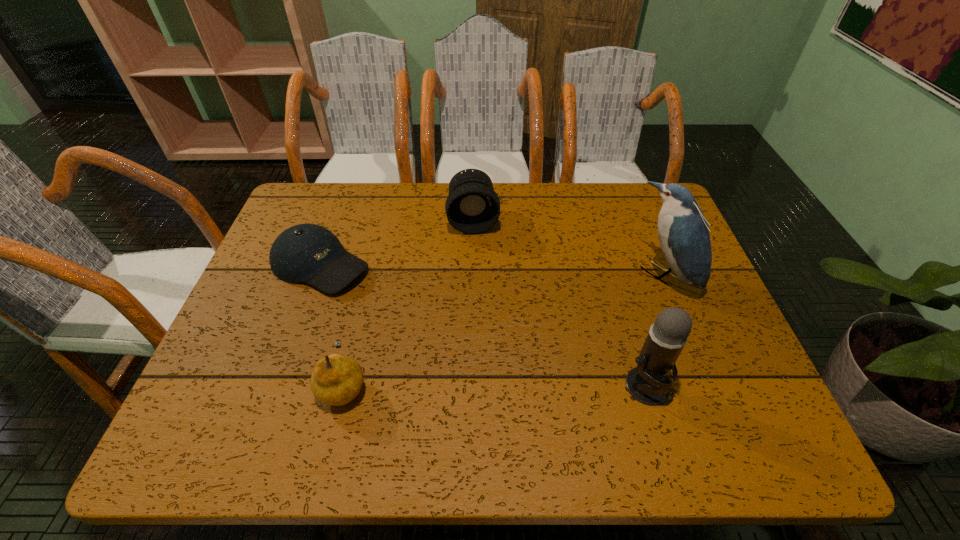
Where is `the second shortest object`? The width and height of the screenshot is (960, 540). the second shortest object is located at coordinates point(337,379).

I want to click on the fourth object from left to right, so (647, 383).

At what (x,y) coordinates should I click in order to perform the action: click on bird. Please return your answer as a coordinate pair (x, y). The height and width of the screenshot is (540, 960). Looking at the image, I should click on (683, 232).

Where is `baseball cap`? This screenshot has width=960, height=540. baseball cap is located at coordinates (305, 253).

Find the location of `the third object from right to left`. the third object from right to left is located at coordinates tap(472, 206).

The width and height of the screenshot is (960, 540). What are the coordinates of `vacant point located on the back of the pear` in the screenshot? It's located at (361, 316).

You are a GUI agent. You are given a task and a screenshot of the screen. Output one action in this format:
    pyautogui.click(x=<x>, y=<y>)
    Task: Click on the free space located 0.060m on the left of the fourth object from left to right
    The width and height of the screenshot is (960, 540).
    Given the screenshot: What is the action you would take?
    click(593, 386)

Find the location of a particular element. free space located 0.200m at the tip of the rightmost object's beak is located at coordinates (591, 333).

Find the location of a particular element. Image resolution: width=960 pixels, height=540 pixels. free point located 0.230m at the tip of the rightmost object's beak is located at coordinates (583, 340).

You are a GUI agent. You are given a task and a screenshot of the screen. Output one action in this format:
    pyautogui.click(x=<x>, y=<y>)
    Task: Click on the vacant space situated at the tip of the rightmost object's beak
    Image resolution: width=960 pixels, height=540 pixels.
    Given the screenshot: What is the action you would take?
    pyautogui.click(x=631, y=303)